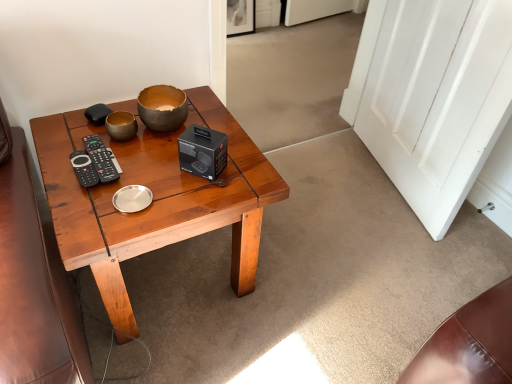
Find the location of a particular element. This screenshot has width=512, height=384. white glossy door at right is located at coordinates (437, 99).

This screenshot has width=512, height=384. Find the location of `black plastic remote at left`. black plastic remote at left is located at coordinates (101, 158).

From a real-world perspective, between wooden coffee table at center and matte brown bowl at center, who is vertically lower?

wooden coffee table at center.

Is wooden coffee table at center smaller than matte brown bowl at center?

Incorrect, wooden coffee table at center is not smaller in size than matte brown bowl at center.

Can you confirm if wooden coffee table at center is shorter than matte brown bowl at center?

No, wooden coffee table at center is not shorter than matte brown bowl at center.

Find the location of a particular element. The width and height of the screenshot is (512, 384). coffee table in front of the matte brown bowl at center is located at coordinates (154, 199).

In terms of height, does wooden coffee table at center look taller or shorter compared to white glossy door at right?

wooden coffee table at center is shorter than white glossy door at right.

Which object is positioned more to the right, wooden coffee table at center or white glossy door at right?

white glossy door at right.

Locate an element on the screen. coffee table that is under the white glossy door at right (from a real-world perspective) is located at coordinates (154, 199).

From the picture: Who is smaller, wooden coffee table at center or white glossy door at right?

With smaller size is white glossy door at right.

Where is `control that is above the wooden coffee table at center (from a real-world perspective)`? control that is above the wooden coffee table at center (from a real-world perspective) is located at coordinates (101, 158).

From a real-world perspective, is wooden coffee table at center located beneath black plastic remote at left?

Yes.

Does wooden coffee table at center lie behind black plastic remote at left?

No.

Between wooden coffee table at center and black plastic remote at left, which one has smaller size?

With smaller size is black plastic remote at left.

How many degrees apart are the facing directions of white glossy door at right and black plastic remote at left?

The facing directions of white glossy door at right and black plastic remote at left are 111 degrees apart.

In the scene shown: Can black plastic remote at left be found inside white glossy door at right?

No, black plastic remote at left is not inside white glossy door at right.

In the scene shown: How distant is white glossy door at right from black plastic remote at left?

white glossy door at right and black plastic remote at left are 1.25 meters apart from each other.

Is white glossy door at right facing away from black plastic remote at left?

No.

Considering the points (162, 128) and (240, 238), which point is behind, point (162, 128) or point (240, 238)?

The point (240, 238) is more distant.

Can you confirm if matte brown bowl at center is positioned to the left of wooden coffee table at center?

In fact, matte brown bowl at center is to the right of wooden coffee table at center.

Considering the positions of objects matte brown bowl at center and wooden coffee table at center in the image provided, who is in front, matte brown bowl at center or wooden coffee table at center?

Positioned in front is wooden coffee table at center.

Based on their positions, is black plastic remote at left located to the left or right of wooden coffee table at center?

black plastic remote at left is positioned on wooden coffee table at center's left side.

Can you tell me how much black plastic remote at left and wooden coffee table at center differ in facing direction?

0.539 degrees separate the facing orientations of black plastic remote at left and wooden coffee table at center.

Could you tell me if black plastic remote at left is facing wooden coffee table at center?

Yes, black plastic remote at left is turned towards wooden coffee table at center.

How much distance is there between black plastic remote at left and wooden coffee table at center?

A distance of 23.94 centimeters exists between black plastic remote at left and wooden coffee table at center.

Does matte brown bowl at center appear on the left side of black plastic remote at left?

In fact, matte brown bowl at center is to the right of black plastic remote at left.

Is matte brown bowl at center spatially inside black plastic remote at left, or outside of it?

matte brown bowl at center is not inside black plastic remote at left, it's outside.

From the image's perspective, would you say matte brown bowl at center is positioned over black plastic remote at left?

Yes, from the image's perspective, matte brown bowl at center is over black plastic remote at left.

The width and height of the screenshot is (512, 384). Find the location of `bowl that appears above the wooden coffee table at center (from the image's perspective)`. bowl that appears above the wooden coffee table at center (from the image's perspective) is located at coordinates (162, 107).

Identify the location of coffee table below the white glossy door at right (from the image's perspective). This screenshot has height=384, width=512. [x=154, y=199].

Considering their positions, is black plastic remote at left positioned closer to wooden coffee table at center than white glossy door at right?

The object closer to wooden coffee table at center is black plastic remote at left.

Which object lies nearer to the anchor point white glossy door at right, black plastic remote at left or matte brown bowl at center?

Among the two, matte brown bowl at center is located nearer to white glossy door at right.

Considering their positions, is black plastic remote at left positioned closer to wooden coffee table at center than matte brown bowl at center?

black plastic remote at left lies closer to wooden coffee table at center than the other object.

Based on their spatial positions, is white glossy door at right or wooden coffee table at center further from black plastic remote at left?

Based on the image, white glossy door at right appears to be further to black plastic remote at left.

Which object lies further to the anchor point wooden coffee table at center, white glossy door at right or black plastic remote at left?

white glossy door at right is further to wooden coffee table at center.

Based on their spatial positions, is wooden coffee table at center or matte brown bowl at center closer to black plastic remote at left?

The object closer to black plastic remote at left is matte brown bowl at center.

Based on their spatial positions, is white glossy door at right or wooden coffee table at center closer to matte brown bowl at center?

The object closer to matte brown bowl at center is wooden coffee table at center.

When comparing their distances from white glossy door at right, does matte brown bowl at center or wooden coffee table at center seem further?

Based on the image, matte brown bowl at center appears to be further to white glossy door at right.

This screenshot has width=512, height=384. What are the coordinates of `control between matte brown bowl at center and wooden coffee table at center in the up-down direction` in the screenshot? It's located at (101, 158).

This screenshot has width=512, height=384. What are the coordinates of `bowl situated between wooden coffee table at center and white glossy door at right from left to right` in the screenshot? It's located at (162, 107).

The height and width of the screenshot is (384, 512). I want to click on bowl located between black plastic remote at left and white glossy door at right in the left-right direction, so click(162, 107).

Find the location of a particular element. The image size is (512, 384). coffee table between black plastic remote at left and white glossy door at right is located at coordinates (154, 199).